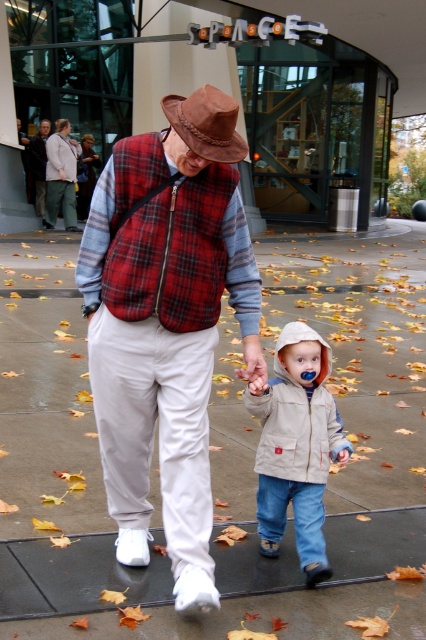
Question: Can you confirm if concrete pavement at center is positioned above brown leather fedora at center?

Choices:
 (A) no
 (B) yes

Answer: (A)

Question: Which point appears farthest from the camera in this image?

Choices:
 (A) (80, 380)
 (B) (183, 604)
 (C) (264, 528)
 (D) (31, 154)

Answer: (D)

Question: Which of the following is the farthest from the observer?

Choices:
 (A) (31, 156)
 (B) (54, 460)
 (C) (184, 138)
 (D) (89, 308)

Answer: (A)

Question: Is khaki fabric jacket at center further to camera compared to brown leather fedora at center?

Choices:
 (A) yes
 (B) no

Answer: (A)

Question: Among these points, which one is nearest to the camera?

Choices:
 (A) (45, 237)
 (B) (302, 369)

Answer: (B)

Question: Is khaki fabric jacket at center positioned at the back of dark gray jacket at upper left?

Choices:
 (A) yes
 (B) no

Answer: (B)